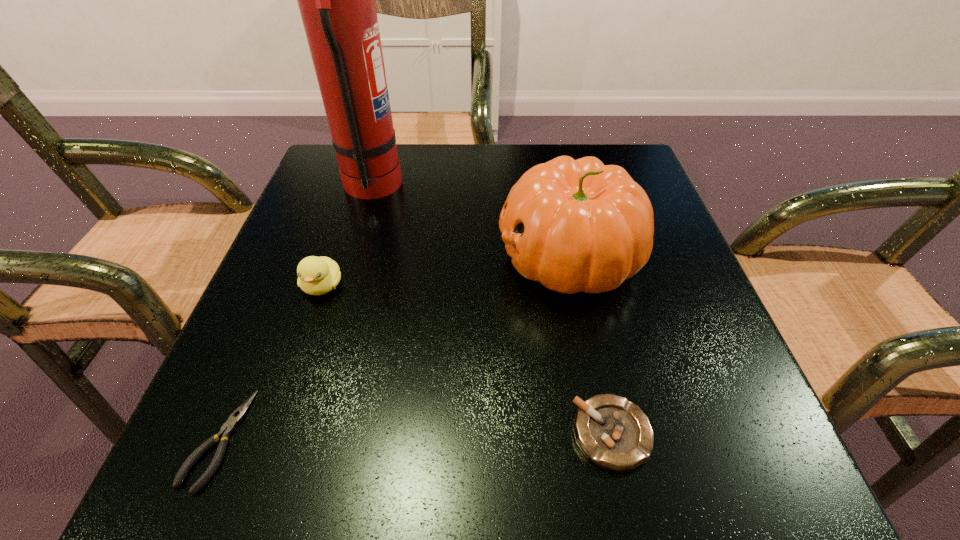
Where is `vacant space that satisfies the following two spatial constraints: 1. on the label side of the tallest object; 2. on the right side of the second shortest object`? vacant space that satisfies the following two spatial constraints: 1. on the label side of the tallest object; 2. on the right side of the second shortest object is located at coordinates (299, 434).

Find the location of a particular element. This screenshot has height=540, width=960. vacant space that satisfies the following two spatial constraints: 1. at the beak of the fourth tallest object; 2. on the left side of the duckling is located at coordinates (273, 434).

Find the location of a particular element. The height and width of the screenshot is (540, 960). free location that satisfies the following two spatial constraints: 1. on the carved face of the second tallest object; 2. on the right side of the fourth tallest object is located at coordinates (606, 434).

Identify the location of vacant area in the image that satisfies the following two spatial constraints: 1. on the carved face of the pumpkin; 2. at the beak of the duckling. This screenshot has height=540, width=960. (575, 286).